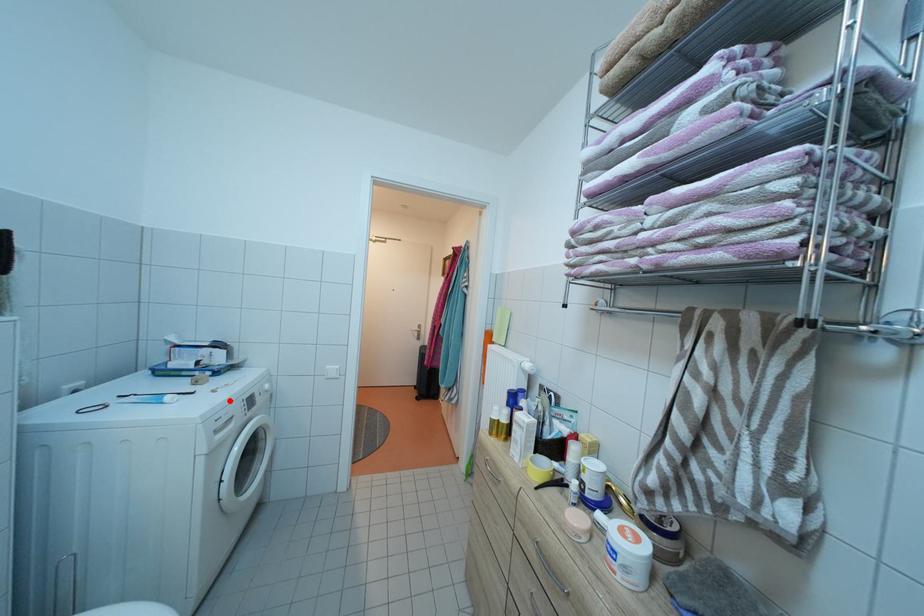
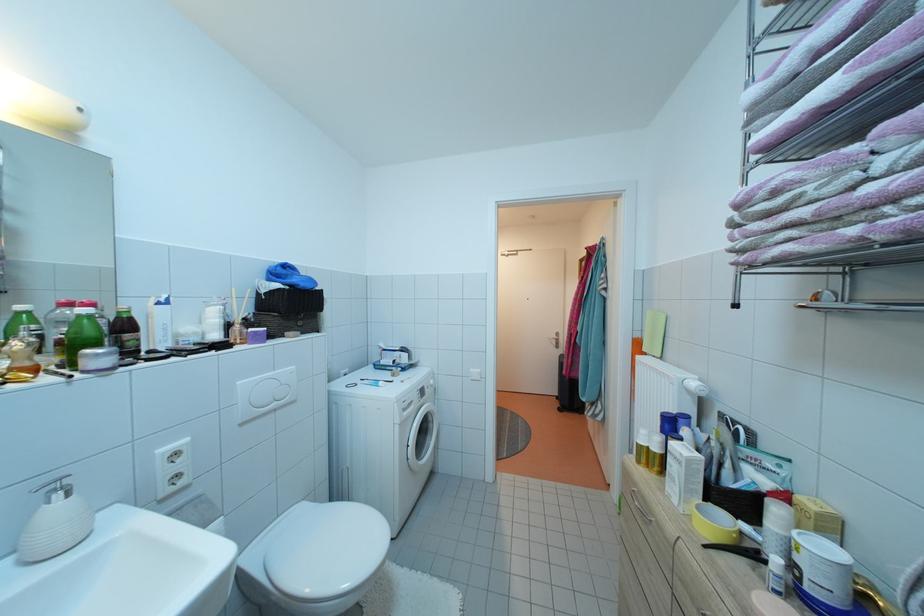
Question: I am providing you with two images of the same scene from different viewpoints. A red point is marked on the first image. At the location where the point appears in image 1, is it still visible in image 2?

Choices:
 (A) Yes
 (B) No

Answer: (A)